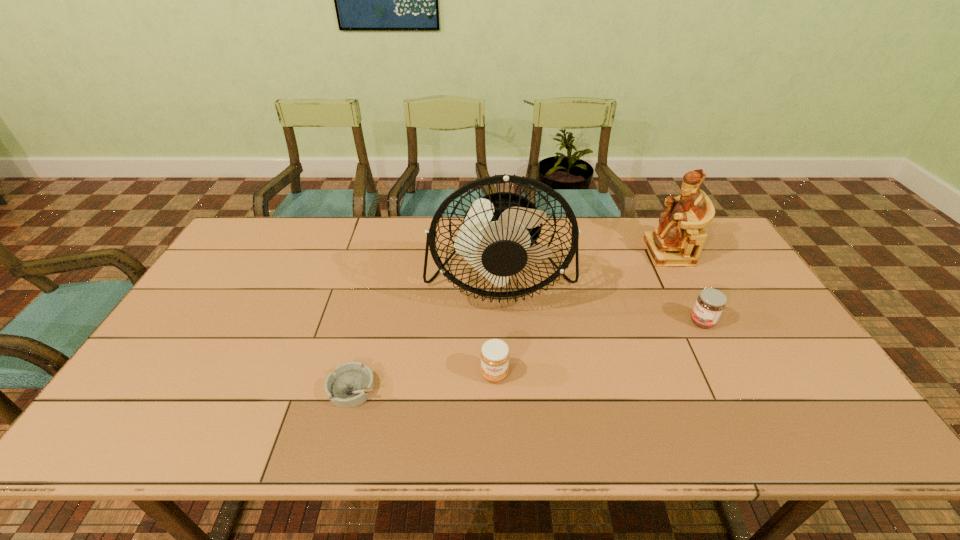
At what (x,y) coordinates should I click in order to perform the action: click on unoccupied position between the left jam and the fourth shortest object. Please return your answer as a coordinate pair (x, y). Looking at the image, I should click on (581, 313).

Find the location of a particular element. This screenshot has height=540, width=960. empty space between the tallest object and the left jam is located at coordinates (497, 326).

The width and height of the screenshot is (960, 540). What are the coordinates of `object that is the third closest one to the shortest object` in the screenshot? It's located at (710, 303).

This screenshot has width=960, height=540. Find the location of `object that stands as the fourth closest to the fourth shortest object`. object that stands as the fourth closest to the fourth shortest object is located at coordinates (351, 384).

The height and width of the screenshot is (540, 960). In order to click on vacant area that satisfies the following two spatial constraints: 1. on the front-facing side of the figurine; 2. on the front side of the farther jam in this screenshot , I will do `click(705, 322)`.

At what (x,y) coordinates should I click in order to perform the action: click on free space that satisfies the following two spatial constraints: 1. on the front-facing side of the fourth shortest object; 2. on the front label of the nearer jam. Please return your answer as a coordinate pair (x, y). The height and width of the screenshot is (540, 960). Looking at the image, I should click on pyautogui.click(x=732, y=374).

Find the location of a particular element. The height and width of the screenshot is (540, 960). vacant point that satisfies the following two spatial constraints: 1. on the front-facing side of the fourth shortest object; 2. on the front side of the leftmost object is located at coordinates (739, 388).

The image size is (960, 540). What are the coordinates of `vacant area that satisfies the following two spatial constraints: 1. on the front-facing side of the figurine; 2. in front of the fan, directing airflow` in the screenshot? It's located at (682, 279).

Where is `vacant space that satisfies the following two spatial constraints: 1. in front of the right jam, directing airflow; 2. on the right side of the fan`? This screenshot has width=960, height=540. vacant space that satisfies the following two spatial constraints: 1. in front of the right jam, directing airflow; 2. on the right side of the fan is located at coordinates (502, 322).

Image resolution: width=960 pixels, height=540 pixels. What are the coordinates of `free location that satisfies the following two spatial constraints: 1. on the front-facing side of the figurine; 2. in front of the fan, directing airflow` in the screenshot? It's located at (682, 279).